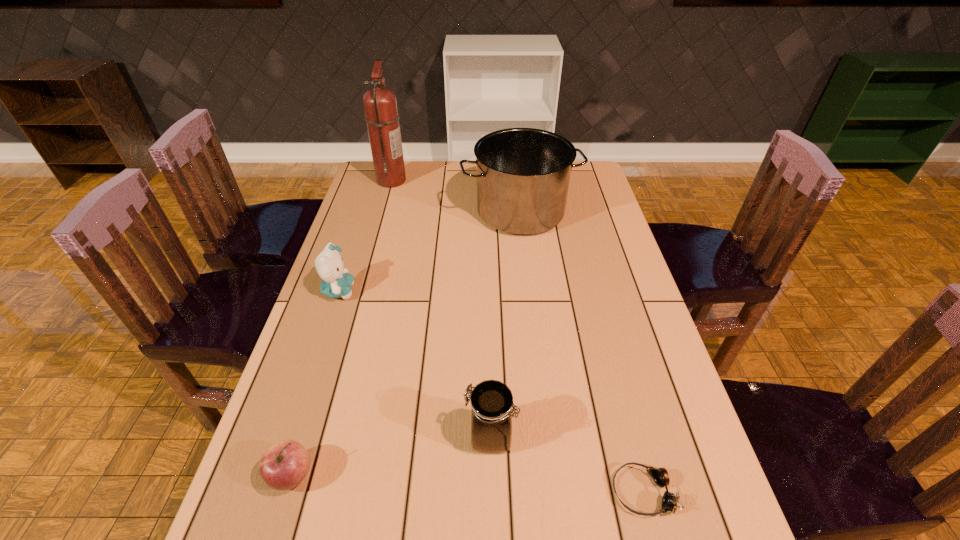
Where is `free space that is in between the second shortest object and the tallest object`? The width and height of the screenshot is (960, 540). free space that is in between the second shortest object and the tallest object is located at coordinates (342, 328).

Find the location of `free spot between the fifth tallest object and the shortest object`. free spot between the fifth tallest object and the shortest object is located at coordinates (467, 484).

Locate an element on the screen. The image size is (960, 540). free area in between the second tallest object and the fifth tallest object is located at coordinates (406, 343).

Image resolution: width=960 pixels, height=540 pixels. I want to click on vacant space in between the jar and the apple, so click(x=391, y=456).

The image size is (960, 540). What are the coordinates of `free space between the shortest object and the tallest object` in the screenshot? It's located at 517,336.

At what (x,y) coordinates should I click in order to perform the action: click on blank region between the fifth shortest object and the shortest object. Please return your answer as a coordinate pair (x, y). Looking at the image, I should click on (582, 352).

The image size is (960, 540). In order to click on free space that is in between the fifth shortest object and the apple in this screenshot , I will do `click(406, 343)`.

The height and width of the screenshot is (540, 960). I want to click on empty location between the goggles and the second tallest object, so click(x=582, y=352).

Identify which object is the fifth nearest to the shortest object. Please provide its 2D coordinates. Your answer should be formatted as a tuple, i.e. [(x, y)], where the tuple contains the x and y coordinates of a point satisfying the conditions above.

[(380, 106)]

Identify the location of object that ranks as the second closest to the third farthest object. (284, 465).